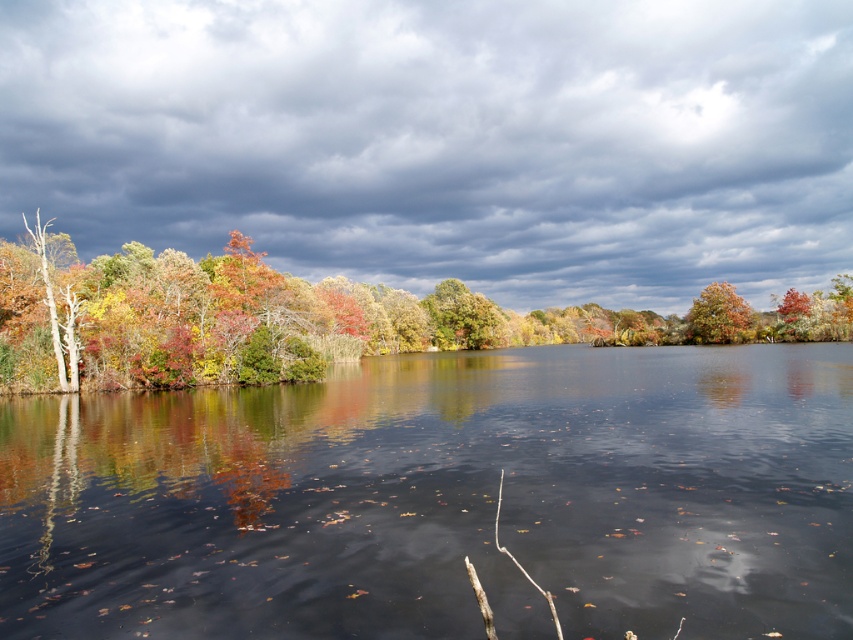
Can you confirm if smooth reflective water at center is bigger than orange matte tree at upper right?

Yes.

Between smooth reflective water at center and orange matte tree at upper right, which one appears on the right side from the viewer's perspective?

From the viewer's perspective, orange matte tree at upper right appears more on the right side.

The width and height of the screenshot is (853, 640). Describe the element at coordinates (442, 499) in the screenshot. I see `smooth reflective water at center` at that location.

Find the location of `smooth reflective water at center`. smooth reflective water at center is located at coordinates (442, 499).

Is smooth reflective water at center behind orange matte tree at center-right?

No, smooth reflective water at center is closer to the viewer.

Between smooth reflective water at center and orange matte tree at center-right, which one appears on the right side from the viewer's perspective?

orange matte tree at center-right

The image size is (853, 640). What do you see at coordinates (442, 499) in the screenshot?
I see `smooth reflective water at center` at bounding box center [442, 499].

You are a GUI agent. You are given a task and a screenshot of the screen. Output one action in this format:
    pyautogui.click(x=<x>, y=<y>)
    Task: Click on the smooth reflective water at center
    Image resolution: width=853 pixels, height=640 pixels.
    Given the screenshot: What is the action you would take?
    pyautogui.click(x=442, y=499)

In the scene shown: Who is positioned more to the left, smooth reflective water at center or autumn foliage at left?

smooth reflective water at center

Is point (722, 608) more distant than point (193, 342)?

No.

This screenshot has width=853, height=640. I want to click on smooth reflective water at center, so click(442, 499).